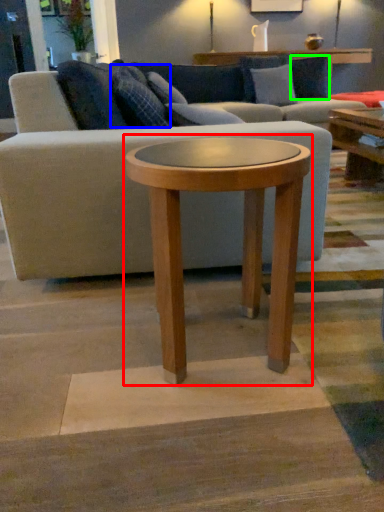
Question: Based on their relative distances, which object is nearer to coffee table (highlighted by a red box)? Choose from pillow (highlighted by a blue box) and pillow (highlighted by a green box).

Choices:
 (A) pillow
 (B) pillow

Answer: (A)